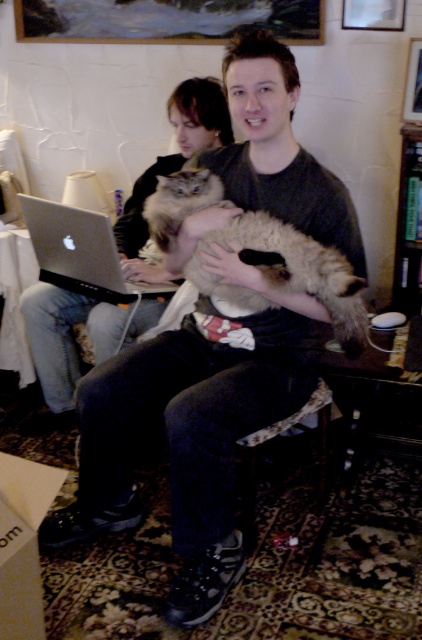
Question: Is silver metallic laptop at left above wooden bookshelf at right?

Choices:
 (A) yes
 (B) no

Answer: (B)

Question: Which point appears closest to the camera in this image?

Choices:
 (A) (165, 240)
 (B) (414, 198)
 (C) (208, 145)

Answer: (A)

Question: Does fuzzy brown cat at center appear under wooden bookshelf at right?

Choices:
 (A) yes
 (B) no

Answer: (A)

Question: Based on their relative distances, which object is nearer to the fluffy cat at center?

Choices:
 (A) wooden bookshelf at right
 (B) fuzzy brown cat at center

Answer: (B)

Question: Can you confirm if fuzzy brown cat at center is bigger than wooden bookshelf at right?

Choices:
 (A) no
 (B) yes

Answer: (B)

Question: Which object appears farthest from the camera in this image?

Choices:
 (A) fluffy cat at center
 (B) silver metallic laptop at left
 (C) fuzzy brown cat at center
 (D) wooden bookshelf at right

Answer: (A)